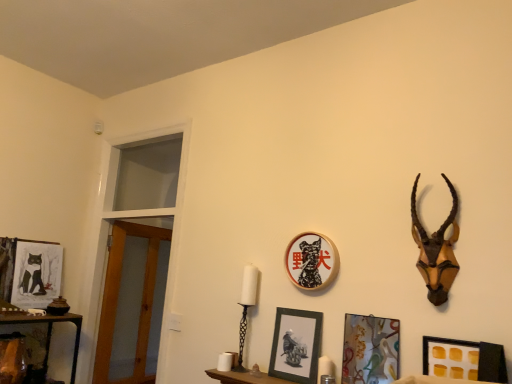
Question: Is matte black picture frame at center, which is counted as the 3th picture frame, starting from the back, closer to the viewer compared to black matte picture frame at lower right, arranged as the 5th picture frame when viewed from the left?

Choices:
 (A) no
 (B) yes

Answer: (A)

Question: Is the depth of matte black picture frame at center, placed as the second picture frame when sorted from left to right, greater than that of black matte picture frame at lower right, which ranks as the 1th picture frame in right-to-left order?

Choices:
 (A) yes
 (B) no

Answer: (A)

Question: Is matte black picture frame at center, which is counted as the 3th picture frame, starting from the back, in contact with black matte picture frame at lower right, arranged as the 5th picture frame when viewed from the left?

Choices:
 (A) no
 (B) yes

Answer: (A)

Question: Is matte black picture frame at center, the 3th picture frame viewed from the front, not near black matte picture frame at lower right, the first picture frame positioned from the front?

Choices:
 (A) yes
 (B) no

Answer: (B)

Question: Is matte black picture frame at center, the 3th picture frame viewed from the front, taller than black matte picture frame at lower right, arranged as the 5th picture frame when viewed from the left?

Choices:
 (A) yes
 (B) no

Answer: (A)

Question: From the image's perspective, would you say matte black picture frame at center, which ranks as the 4th picture frame in right-to-left order, is shown under black matte picture frame at lower right, which is the fifth picture frame in back-to-front order?

Choices:
 (A) no
 (B) yes

Answer: (B)

Question: Considering the relative sizes of black matte picture frame at lower right, the first picture frame positioned from the front, and metallic glass picture frame at lower right, which is the 4th picture frame in back-to-front order, in the image provided, is black matte picture frame at lower right, the first picture frame positioned from the front, smaller than metallic glass picture frame at lower right, which is the 4th picture frame in back-to-front order,?

Choices:
 (A) yes
 (B) no

Answer: (A)

Question: Is black matte picture frame at lower right, which is the fifth picture frame in back-to-front order, further to the viewer compared to metallic glass picture frame at lower right, positioned as the second picture frame in front-to-back order?

Choices:
 (A) yes
 (B) no

Answer: (B)

Question: Does black matte picture frame at lower right, arranged as the 5th picture frame when viewed from the left, have a larger size compared to metallic glass picture frame at lower right, positioned as the second picture frame in front-to-back order?

Choices:
 (A) yes
 (B) no

Answer: (B)

Question: Is black matte picture frame at lower right, arranged as the 5th picture frame when viewed from the left, closer to camera compared to metallic glass picture frame at lower right, which is the 4th picture frame in back-to-front order?

Choices:
 (A) yes
 (B) no

Answer: (A)

Question: Is black matte picture frame at lower right, arranged as the 5th picture frame when viewed from the left, shorter than metallic glass picture frame at lower right, positioned as the second picture frame in front-to-back order?

Choices:
 (A) yes
 (B) no

Answer: (A)

Question: From the image's perspective, is black matte picture frame at lower right, the first picture frame positioned from the front, over metallic glass picture frame at lower right, which is the 4th picture frame in back-to-front order?

Choices:
 (A) yes
 (B) no

Answer: (B)

Question: Can you confirm if matte wood shelf at lower center is smaller than matte black picture frame at left, which is the fifth picture frame from right to left?

Choices:
 (A) yes
 (B) no

Answer: (A)